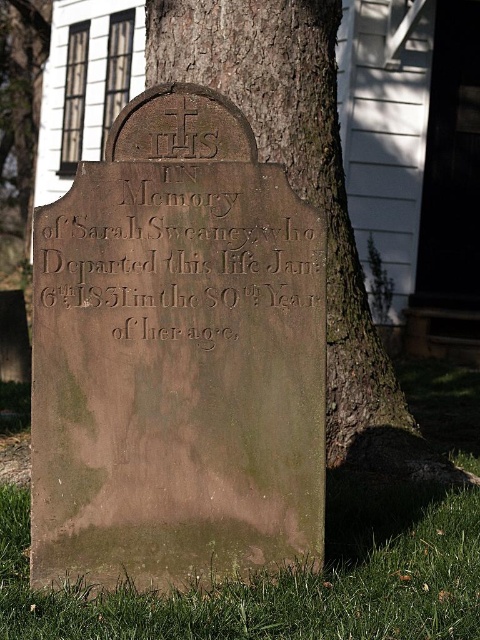
You are standing in front of the gravestone described in the scene. Where is the green grass at lower center located?

The green grass at lower center is located at point (286, 580).

You are a historian examining the gravestone. You notice two elements at the center of the stone. Which one is larger in size between the brown stone inscription at center and the brown rough bark at center?

The brown rough bark at center is larger than the brown stone inscription at center.